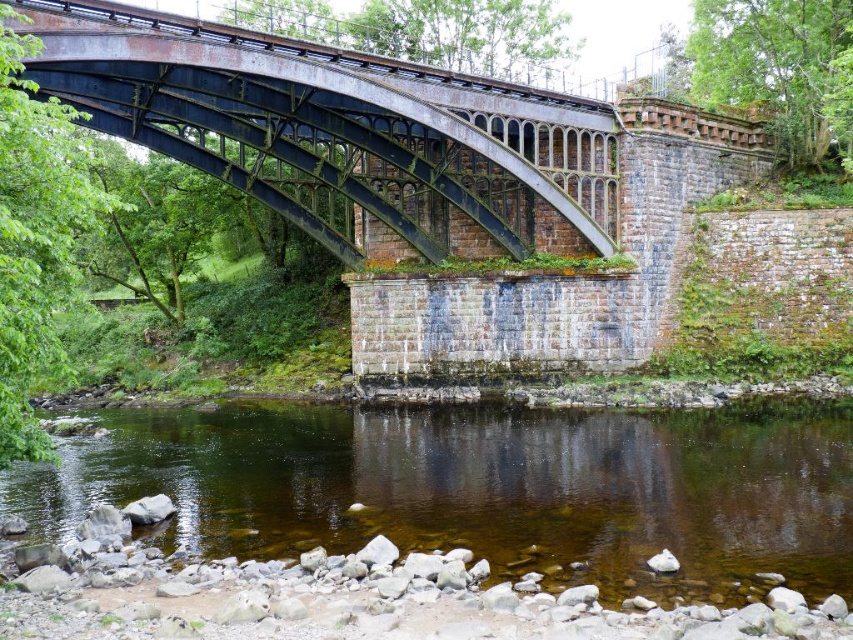
You are standing on the bank of the river and see the clear water at center and the rusty metal arch bridge at center. Which object is located to the right side from your perspective?

The clear water at center is to the right of the rusty metal arch bridge at center, so the clear water at center is located to the right side from your perspective.

You are a photographer planning to capture the rusty metal arch bridge at center and the clear water at center in a single shot. Based on their heights, which object will appear larger in the photo?

The rusty metal arch bridge at center will appear larger in the photo because it is taller than the clear water at center, which is shorter.